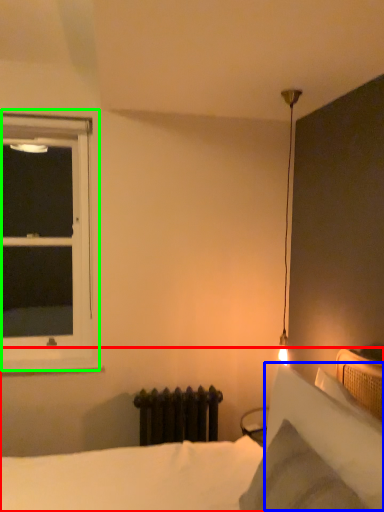
Question: Based on their relative distances, which object is farther from bed (highlighted by a red box)? Choose from pillow (highlighted by a blue box) and window (highlighted by a green box).

Choices:
 (A) pillow
 (B) window

Answer: (B)